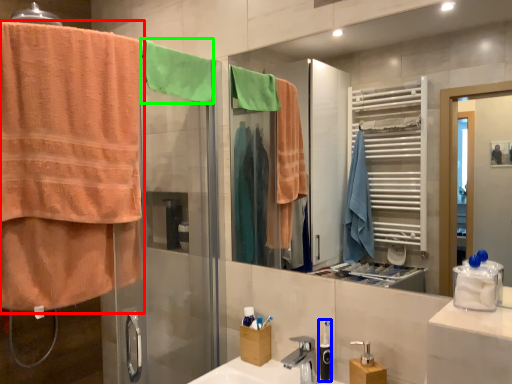
Question: Estimate the real-world distances between objects in this image. Which object is farther from towel (highlighted by a red box), toiletry (highlighted by a blue box) or beach towel (highlighted by a green box)?

Choices:
 (A) toiletry
 (B) beach towel

Answer: (A)